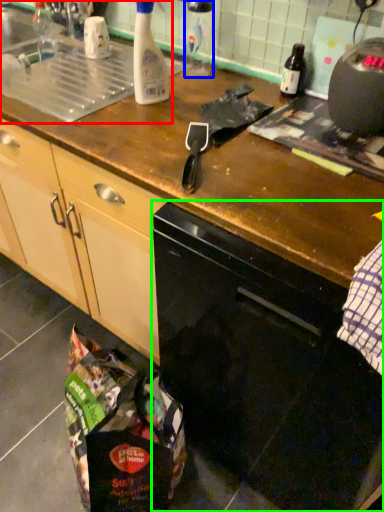
Question: Estimate the real-world distances between objects in this image. Which object is farther from sink (highlighted by a red box), bottle (highlighted by a blue box) or home appliance (highlighted by a green box)?

Choices:
 (A) bottle
 (B) home appliance

Answer: (B)